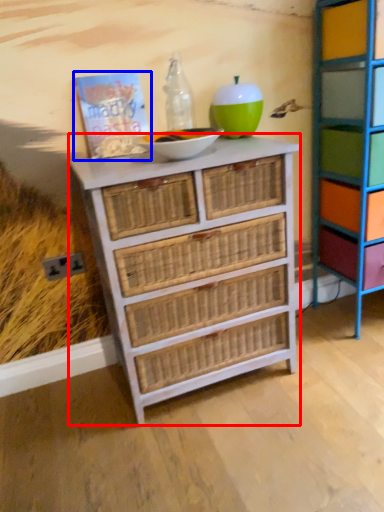
Question: Which object appears closest to the camera in this image, chest of drawers (highlighted by a red box) or book (highlighted by a blue box)?

Choices:
 (A) chest of drawers
 (B) book

Answer: (A)